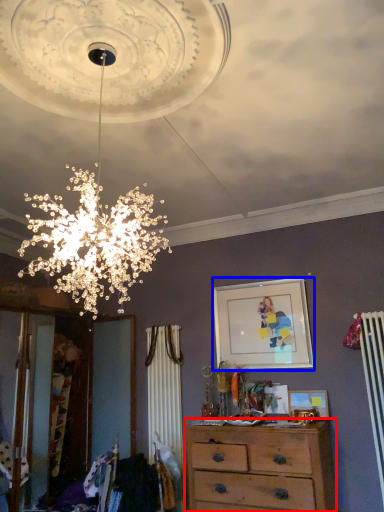
Question: Which object is further to the camera taking this photo, chest of drawers (highlighted by a red box) or picture frame (highlighted by a blue box)?

Choices:
 (A) chest of drawers
 (B) picture frame

Answer: (B)